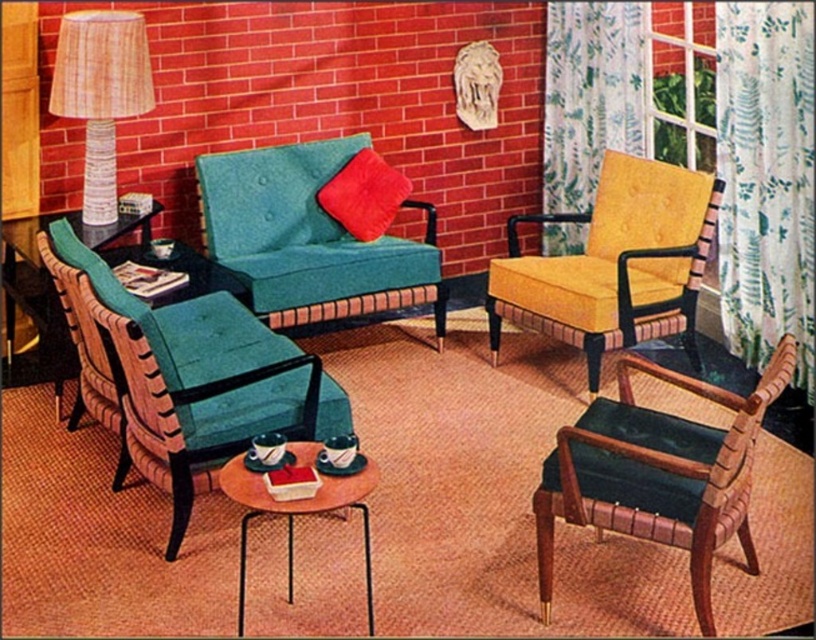
Question: Which of the following is the farthest from the observer?

Choices:
 (A) green floral fabric curtain at right
 (B) white wicker lampshade at left

Answer: (A)

Question: Which object appears closest to the camera in this image?

Choices:
 (A) yellow fabric armchair at right
 (B) velvet red pillow at center
 (C) teal fabric couch at center

Answer: (A)

Question: Is teal fabric armchair at center thinner than velvet dark green armchair at lower right?

Choices:
 (A) no
 (B) yes

Answer: (A)

Question: Among these points, which one is farthest from the camera?

Choices:
 (A) (786, 35)
 (B) (76, 284)
 (C) (300, 186)

Answer: (C)

Question: Can you confirm if yellow fabric armchair at right is wider than velvet red pillow at center?

Choices:
 (A) no
 (B) yes

Answer: (B)

Question: Considering the relative positions of white wicker lampshade at left and wooden round table at center in the image provided, where is white wicker lampshade at left located with respect to wooden round table at center?

Choices:
 (A) above
 (B) below

Answer: (A)